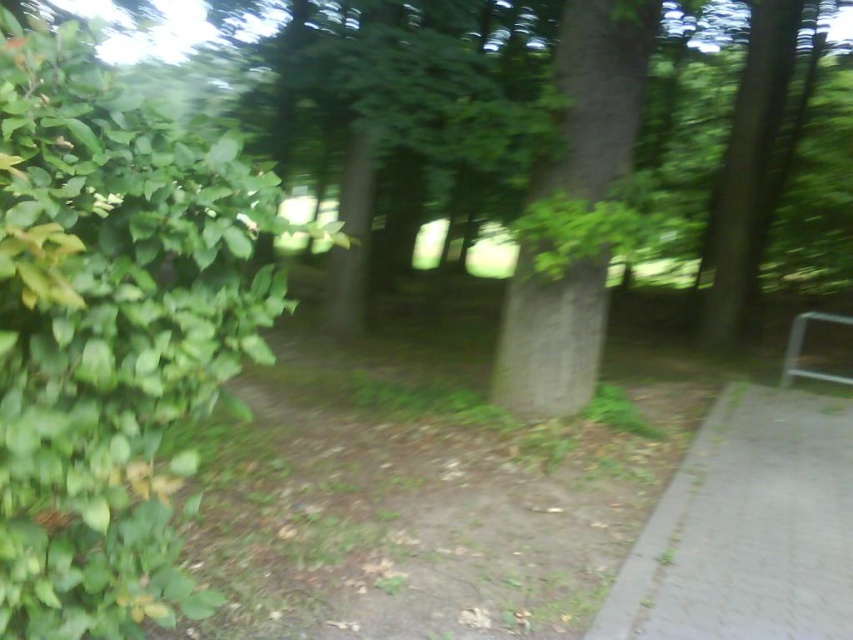
You are a hiker walking along the path in the forest and you see the green leafy bush at left and the green rough bark tree at center. Which object is closer to the ground?

The green leafy bush at left is located below the green rough bark tree at center, so the green leafy bush at left is closer to the ground.